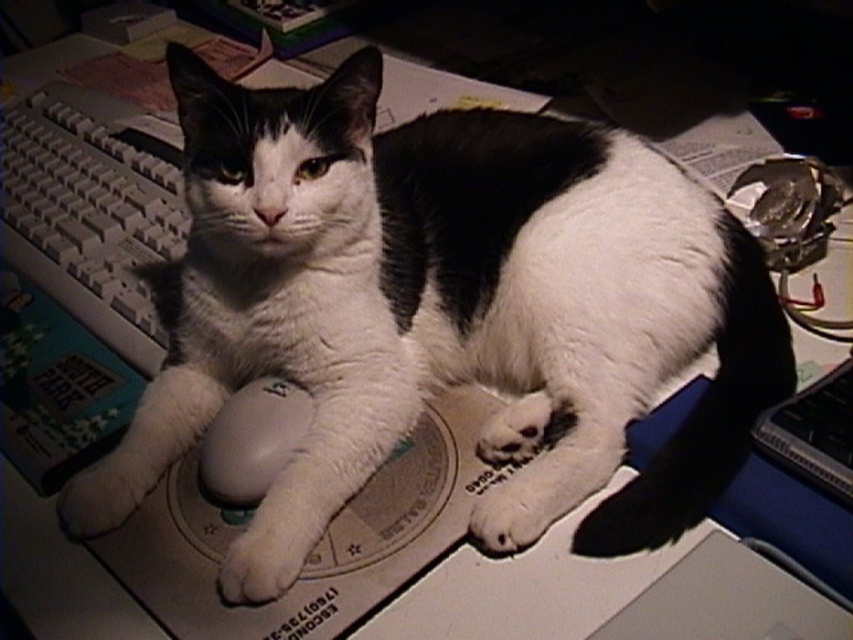
From the picture: Between white plastic keyboard at left and white matte mouse at center, which one has more height?

Standing taller between the two is white plastic keyboard at left.

Between point (114, 220) and point (281, 468), which one is positioned in front?

Point (281, 468) is more forward.

Where is `white plastic keyboard at left`? white plastic keyboard at left is located at coordinates (90, 220).